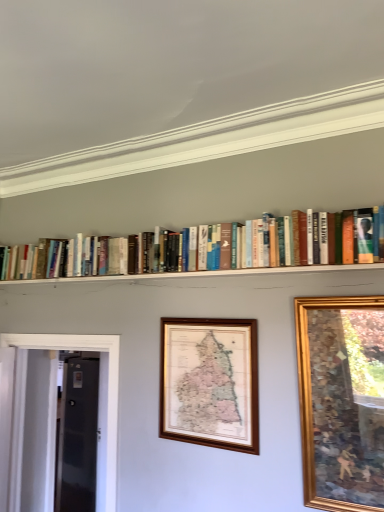
Question: Is point (344, 267) closer or farther from the camera than point (359, 430)?

Choices:
 (A) farther
 (B) closer

Answer: (A)

Question: Is hardcover books at upper center in front of or behind gold wooden picture frame at upper right, which is the first picture frame in front-to-back order, in the image?

Choices:
 (A) behind
 (B) front

Answer: (A)

Question: Which is nearer to the hardcover books at upper center?

Choices:
 (A) transparent glass door at left
 (B) wooden map at center, marked as the 1th picture frame in a back-to-front arrangement
 (C) gold wooden picture frame at upper right, which ranks as the 2th picture frame in left-to-right order

Answer: (B)

Question: Estimate the real-world distances between objects in this image. Which object is farther from the gold wooden picture frame at upper right, the 1th picture frame positioned from the right?

Choices:
 (A) transparent glass door at left
 (B) hardcover books at upper center
 (C) wooden map at center, which is the 2th picture frame from front to back

Answer: (A)